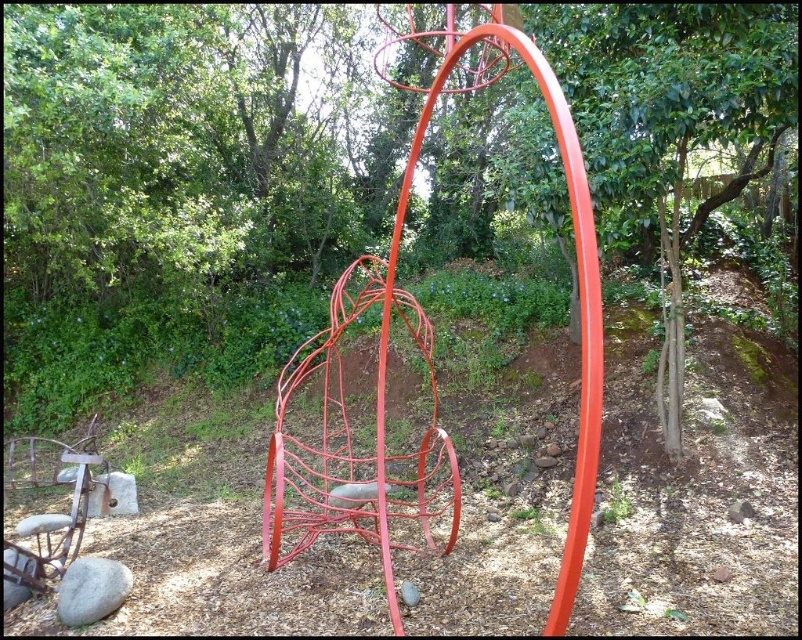
Question: Is the position of glossy metal basketball hoop at center less distant than that of gray smooth rock at lower left?

Choices:
 (A) no
 (B) yes

Answer: (B)

Question: Is glossy metal basketball hoop at center smaller than gray smooth rock at lower left?

Choices:
 (A) no
 (B) yes

Answer: (B)

Question: Among these objects, which one is nearest to the camera?

Choices:
 (A) gray smooth rock at lower left
 (B) glossy metal basketball hoop at center

Answer: (B)

Question: Does glossy metal basketball hoop at center appear under gray smooth rock at lower left?

Choices:
 (A) yes
 (B) no

Answer: (B)

Question: Which object appears farthest from the camera in this image?

Choices:
 (A) glossy metal basketball hoop at center
 (B) gray smooth rock at lower left

Answer: (B)

Question: Which object appears farthest from the camera in this image?

Choices:
 (A) gray smooth rock at lower left
 (B) glossy metal basketball hoop at center

Answer: (A)